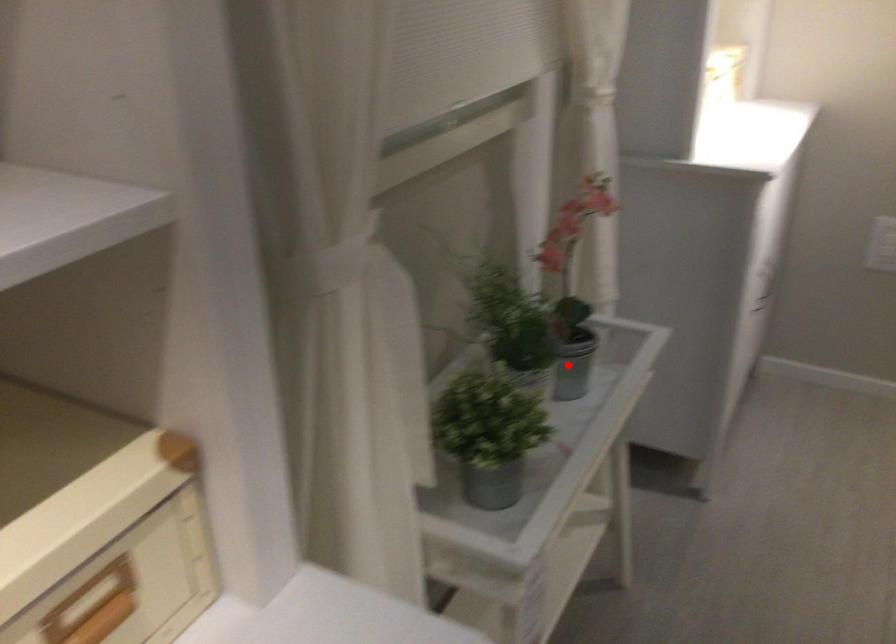
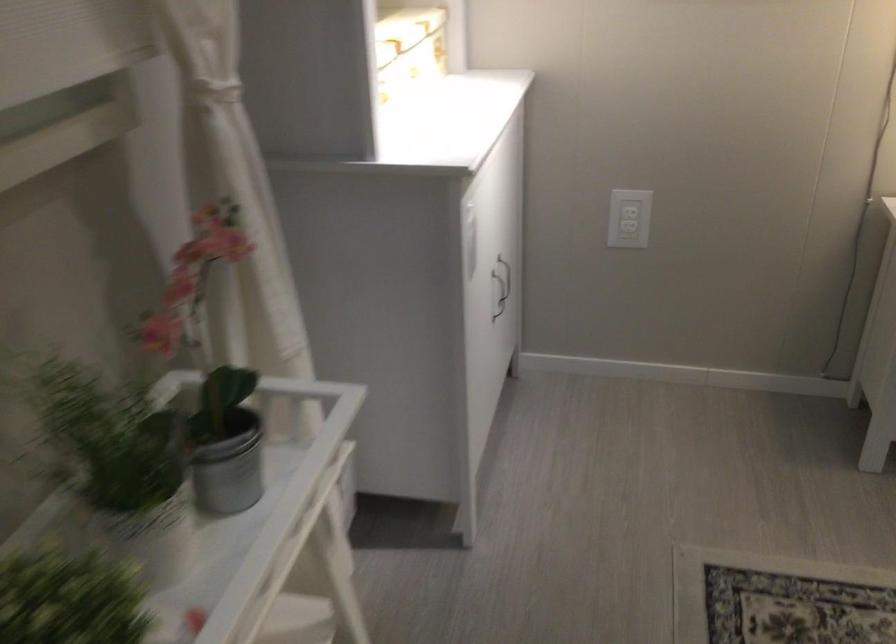
Question: I am providing you with two images of the same scene from different viewpoints. Given a red point in image1, look at the same physical point in image2. Is it:

Choices:
 (A) Closer to the viewpoint
 (B) Farther from the viewpoint

Answer: (A)